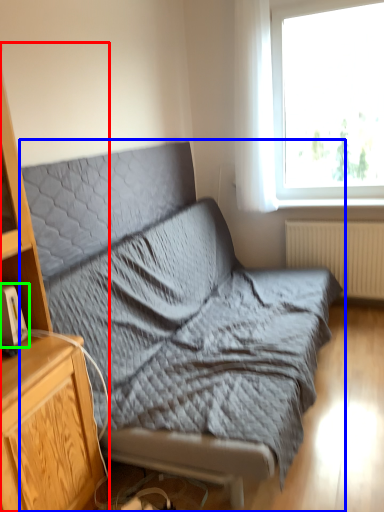
Question: Based on their relative distances, which object is farther from cabinetry (highlighted by a red box)? Choose from studio couch (highlighted by a blue box) and gadget (highlighted by a green box).

Choices:
 (A) studio couch
 (B) gadget

Answer: (A)